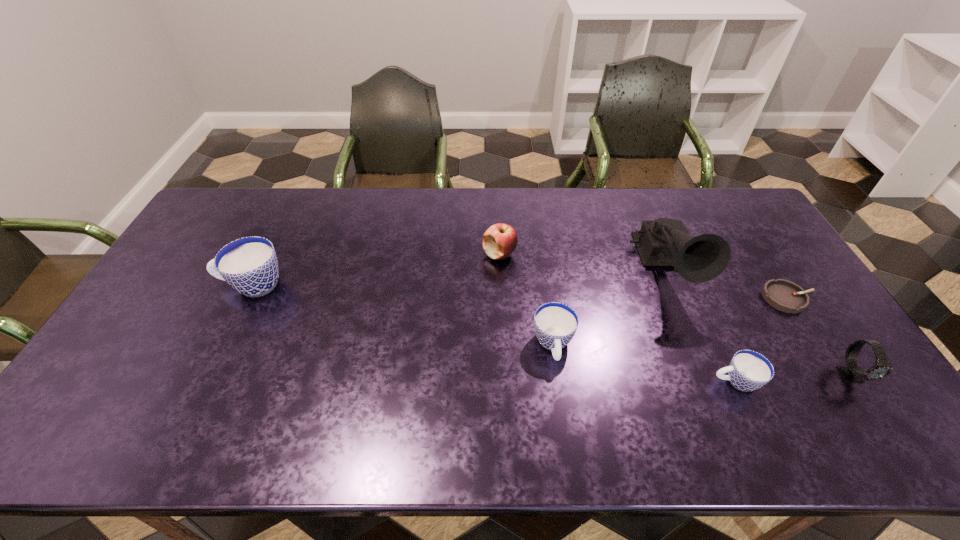
Identify the location of vacant area situated 0.170m on the side of the leftmost object with the handle. The image size is (960, 540). (161, 285).

At what (x,y) coordinates should I click in order to perform the action: click on vacant space located on the side of the leftmost object with the handle. Please return your answer as a coordinate pair (x, y). The height and width of the screenshot is (540, 960). Looking at the image, I should click on (187, 285).

I want to click on vacant space located on the side of the leftmost object with the handle, so click(x=180, y=285).

In order to click on vacant space located 0.100m on the side of the third shortest object with the handle in this screenshot , I will do point(562,404).

Where is `free space located on the side of the second shortest object with the handle`? free space located on the side of the second shortest object with the handle is located at coordinates (588, 381).

Identify the location of free spot located on the side of the second shortest object with the handle. (672, 381).

Where is `blank space located on the side of the second shortest object with the handle`? The image size is (960, 540). blank space located on the side of the second shortest object with the handle is located at coordinates (656, 381).

Locate an element on the screen. vacant region located 0.260m from the horn of the tallest object is located at coordinates (716, 393).

Where is `free space located on the front of the shortest object`? This screenshot has height=540, width=960. free space located on the front of the shortest object is located at coordinates (817, 345).

The image size is (960, 540). Find the location of `vacant space located on the left of the sixth object from right to left`. vacant space located on the left of the sixth object from right to left is located at coordinates [437, 254].